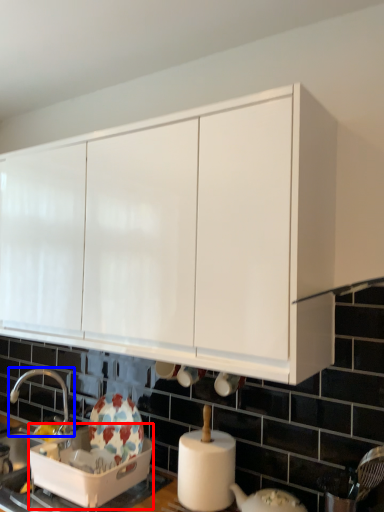
Question: Among these objects, which one is farthest to the camera, appliance (highlighted by a red box) or tap (highlighted by a blue box)?

Choices:
 (A) appliance
 (B) tap

Answer: (B)